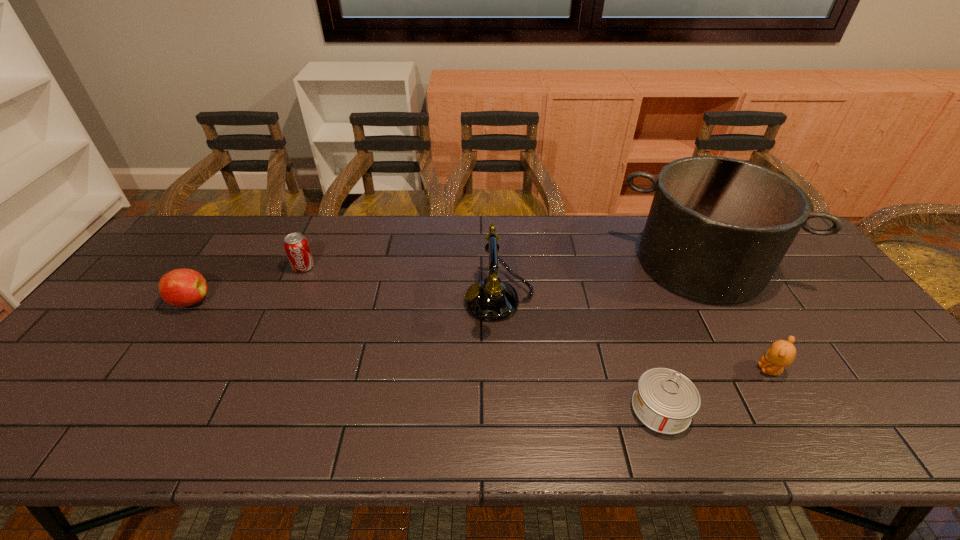
You are a GUI agent. You are given a task and a screenshot of the screen. Output one action in this format:
    pyautogui.click(x=<x>, y=<y>)
    Task: Click on the free space that is in between the fifth farthest object and the fifth shortest object
    This screenshot has width=960, height=540.
    Given the screenshot: What is the action you would take?
    pyautogui.click(x=635, y=335)

Identify the location of vacant space that's between the third object from left to right and the second object from left to right. (401, 284).

The width and height of the screenshot is (960, 540). Find the location of `unoccupied position between the fourth object from right to left and the nearest object`. unoccupied position between the fourth object from right to left and the nearest object is located at coordinates (580, 354).

Find the location of `empty location between the second object from left to right and the leftmost object`. empty location between the second object from left to right and the leftmost object is located at coordinates (247, 285).

This screenshot has width=960, height=540. I want to click on free space between the can and the leftmost object, so click(x=425, y=355).

Locate an element on the screen. The height and width of the screenshot is (540, 960). free area in between the teddy bear and the pan is located at coordinates (735, 316).

The image size is (960, 540). Identify the location of free space that is in between the leftmost object and the soda. (247, 285).

Point out which object is positioned as the third nearest to the can. Please provide its 2D coordinates. Your answer should be formatted as a tuple, i.e. [(x, y)], where the tuple contains the x and y coordinates of a point satisfying the conditions above.

[(718, 228)]

Point out which object is positioned as the fourth nearest to the fifth object from right to left. Please provide its 2D coordinates. Your answer should be formatted as a tuple, i.e. [(x, y)], where the tuple contains the x and y coordinates of a point satisfying the conditions above.

[(718, 228)]

Locate an element on the screen. vacant space that satisfies the following two spatial constraints: 1. on the front side of the pan; 2. on the dial of the telephone is located at coordinates (721, 300).